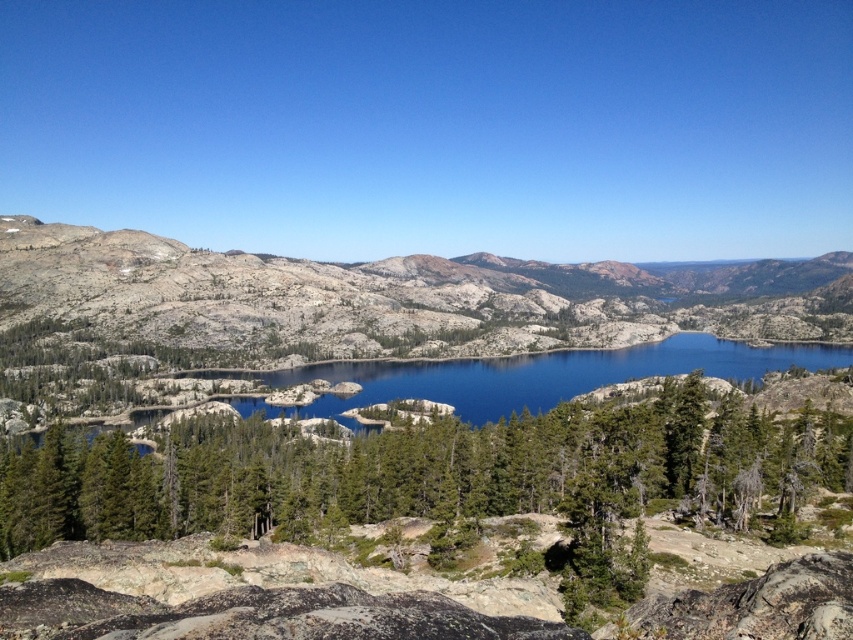
Does gray granite mountain at center have a larger size compared to blue reflective water at center?

Yes, gray granite mountain at center is bigger than blue reflective water at center.

Between gray granite mountain at center and blue reflective water at center, which one has more height?

gray granite mountain at center is taller.

Who is more forward, (396,269) or (651,360)?

Point (651,360) is in front.

This screenshot has width=853, height=640. What are the coordinates of `gray granite mountain at center` in the screenshot? It's located at (389, 300).